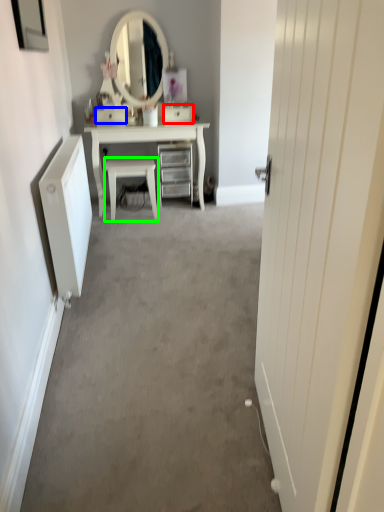
Question: Estimate the real-world distances between objects in this image. Which object is closer to drawer (highlighted by a red box), drawer (highlighted by a blue box) or chair (highlighted by a green box)?

Choices:
 (A) drawer
 (B) chair

Answer: (A)